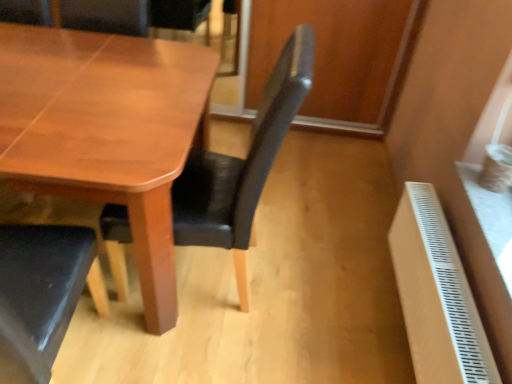
I want to click on free space in front of satin black chair at center, so click(205, 356).